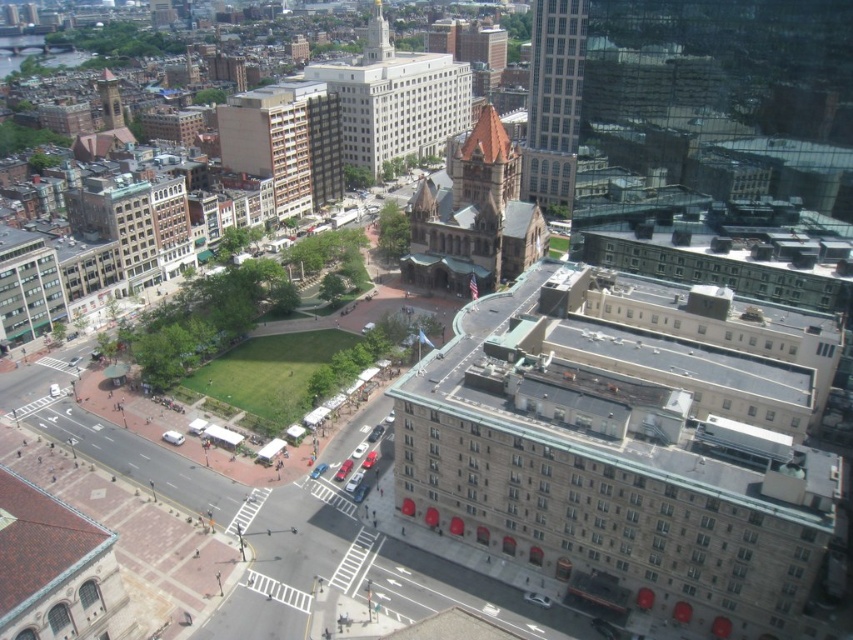
Is brown stone church at center taller than glassy reflective skyscraper at upper right?

Incorrect, brown stone church at center's height is not larger of glassy reflective skyscraper at upper right's.

Can you confirm if brown stone church at center is positioned to the left of glassy reflective skyscraper at upper right?

Correct, you'll find brown stone church at center to the left of glassy reflective skyscraper at upper right.

I want to click on brown stone church at center, so coord(473,218).

Find the location of a particular element. The width and height of the screenshot is (853, 640). brown stone church at center is located at coordinates (473, 218).

Between point (405, 273) and point (372, 17), which one is positioned in front?

Positioned in front is point (405, 273).

Who is positioned more to the left, brown stone church at center or gold textured spire at upper center?

Positioned to the left is gold textured spire at upper center.

Which is in front, point (492, 212) or point (370, 35)?

Point (492, 212)

Locate an element on the screen. Image resolution: width=853 pixels, height=640 pixels. brown stone church at center is located at coordinates (473, 218).

Is white stone building at center to the right of glassy reflective skyscraper at upper right from the viewer's perspective?

No, white stone building at center is not to the right of glassy reflective skyscraper at upper right.

Is white stone building at center shorter than glassy reflective skyscraper at upper right?

In fact, white stone building at center may be taller than glassy reflective skyscraper at upper right.

Between point (355, 90) and point (526, 141), which one is positioned in front?

Point (526, 141) is in front.

At what (x,y) coordinates should I click in order to perform the action: click on white stone building at center. Please return your answer as a coordinate pair (x, y). Image resolution: width=853 pixels, height=640 pixels. Looking at the image, I should click on (395, 100).